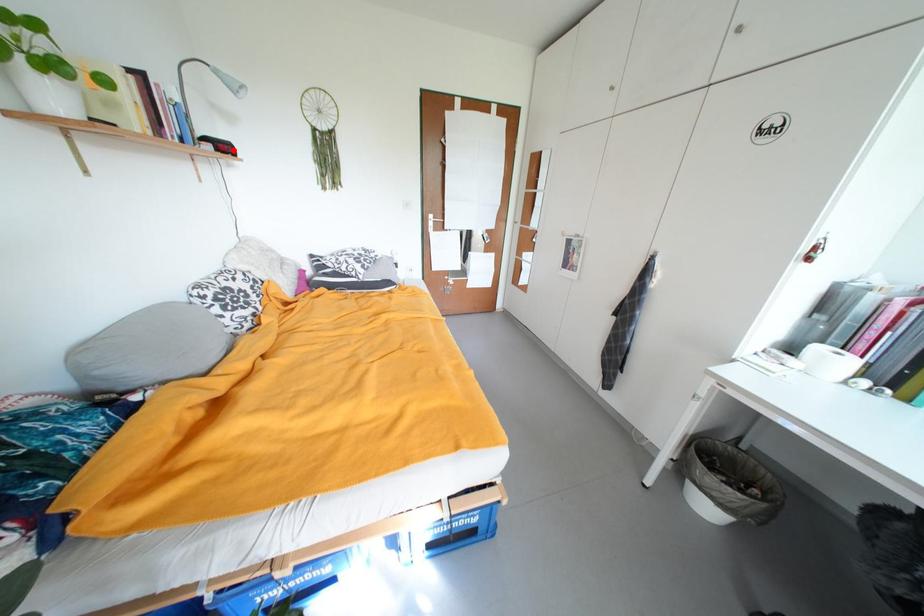
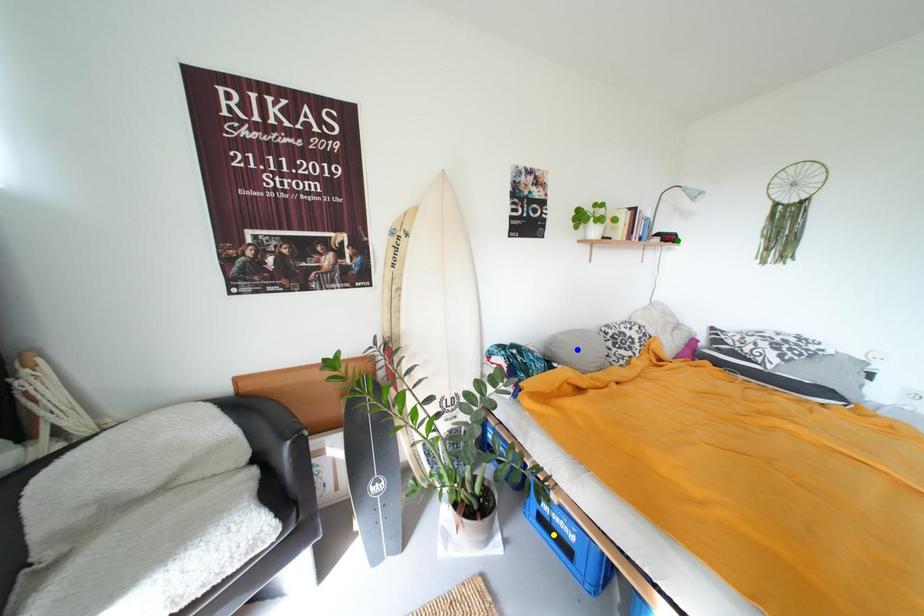
Question: I am providing you with two images of the same scene from different viewpoints. A red point is marked on the first image. You are given multiple points on the second image. In image 2, which mark is for the same physical point as the one in image 1?

Choices:
 (A) green point
 (B) yellow point
 (C) blue point

Answer: (A)